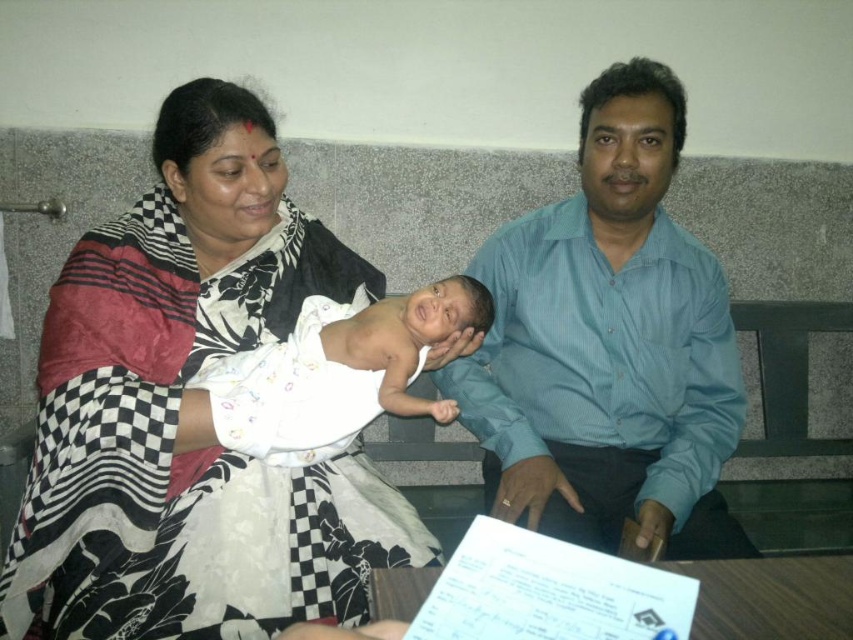
Between black checkered saree at upper left and blue striped shirt at center, which one is positioned lower?

black checkered saree at upper left is lower down.

How far apart are black checkered saree at upper left and blue striped shirt at center?

black checkered saree at upper left is 18.57 inches away from blue striped shirt at center.

Locate an element on the screen. Image resolution: width=853 pixels, height=640 pixels. black checkered saree at upper left is located at coordinates (190, 412).

Identify the location of black checkered saree at upper left. (190, 412).

From the picture: Does black checkered saree at upper left have a greater height compared to white clothed newborn at center?

Correct, black checkered saree at upper left is much taller as white clothed newborn at center.

Does black checkered saree at upper left have a larger size compared to white clothed newborn at center?

Yes, black checkered saree at upper left is bigger than white clothed newborn at center.

What do you see at coordinates (190, 412) in the screenshot?
I see `black checkered saree at upper left` at bounding box center [190, 412].

Find the location of `black checkered saree at upper left`. black checkered saree at upper left is located at coordinates (190, 412).

This screenshot has width=853, height=640. Find the location of `blue striped shirt at center`. blue striped shirt at center is located at coordinates (608, 346).

Which of these two, blue striped shirt at center or white clothed newborn at center, stands taller?

Standing taller between the two is blue striped shirt at center.

Which is in front, point (518, 419) or point (419, 412)?

Point (419, 412)

Where is `blue striped shirt at center`? This screenshot has width=853, height=640. blue striped shirt at center is located at coordinates (608, 346).